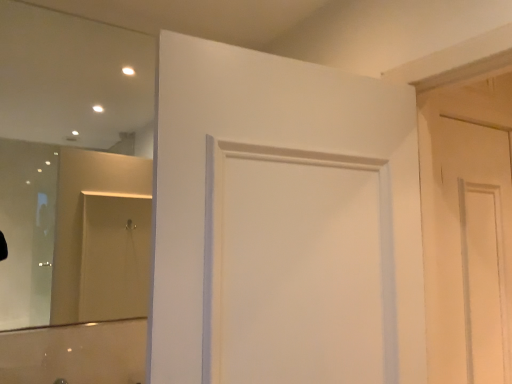
Question: Is point (324, 117) positioned closer to the camera than point (82, 82)?

Choices:
 (A) closer
 (B) farther

Answer: (A)

Question: From the image's perspective, relative to clear glass mirror at upper left, is white matte door at center, the 2th door positioned from the right, above or below?

Choices:
 (A) above
 (B) below

Answer: (B)

Question: Estimate the real-world distances between objects in this image. Which object is closer to the white matte door at right, placed as the first door when sorted from right to left?

Choices:
 (A) white matte door at center, which ranks as the second door in back-to-front order
 (B) clear glass mirror at upper left

Answer: (A)

Question: Estimate the real-world distances between objects in this image. Which object is closer to the clear glass mirror at upper left?

Choices:
 (A) white matte door at center, which ranks as the second door in back-to-front order
 (B) white matte door at right, the second door from the front

Answer: (A)